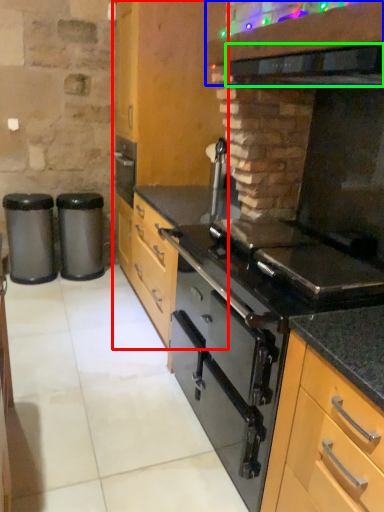
Question: Estimate the real-world distances between objects in this image. Which object is farther from cabinetry (highlighted by a red box), vent (highlighted by a blue box) or exhaust hood (highlighted by a green box)?

Choices:
 (A) vent
 (B) exhaust hood

Answer: (B)